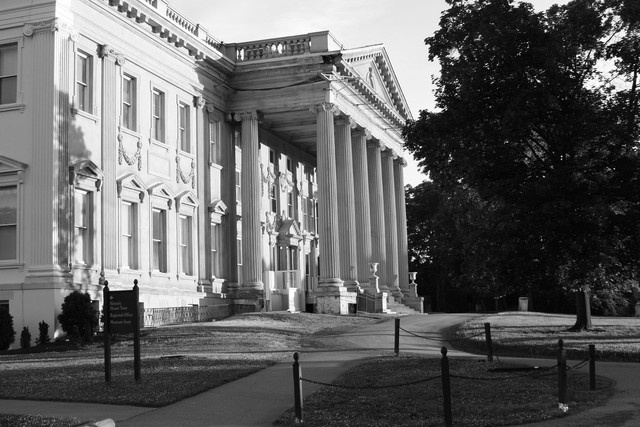
At what (x,y) coordinates should I click in order to perform the action: click on columns. Please return your answer as a coordinate pair (x, y). This screenshot has height=427, width=640. Looking at the image, I should click on (259, 199), (330, 219), (358, 180), (346, 214), (380, 227), (393, 227).